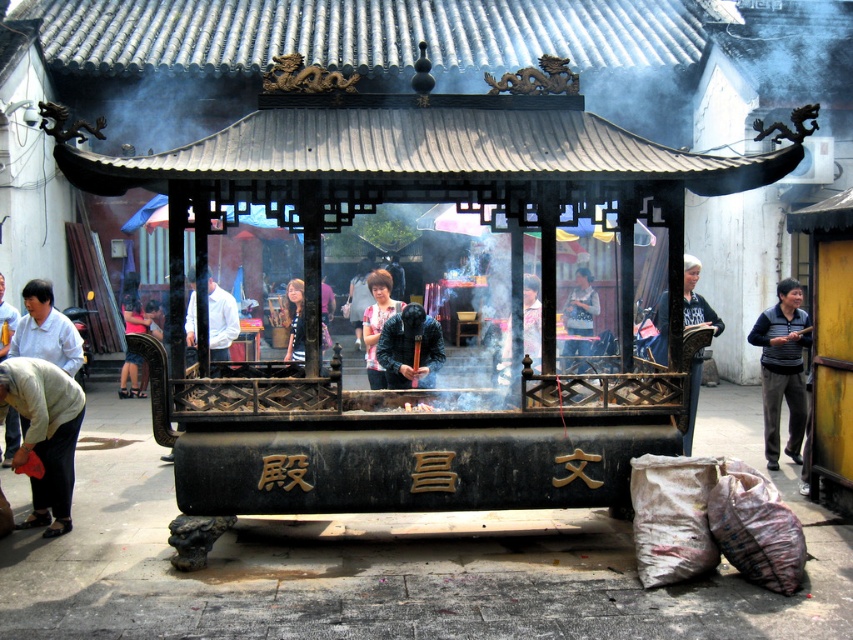
Question: Considering the real-world distances, which object is farthest from the light beige fabric pants at lower left?

Choices:
 (A) gray sweater at right
 (B) white shirt at center

Answer: (A)

Question: Which point is closer to the camera taking this photo?

Choices:
 (A) coord(61,502)
 (B) coord(233,316)

Answer: (A)

Question: Can you confirm if gray sweater at right is positioned to the right of white shirt at center?

Choices:
 (A) yes
 (B) no

Answer: (A)

Question: Which object appears farthest from the camera in this image?

Choices:
 (A) striped shirt at center
 (B) light beige fabric pants at lower left
 (C) gray sweater at right
 (D) white shirt at center

Answer: (A)

Question: Can you confirm if gray sweater at right is positioned above white shirt at center?

Choices:
 (A) no
 (B) yes

Answer: (A)

Question: Can you confirm if white shirt at center is positioned above striped shirt at center?

Choices:
 (A) yes
 (B) no

Answer: (A)